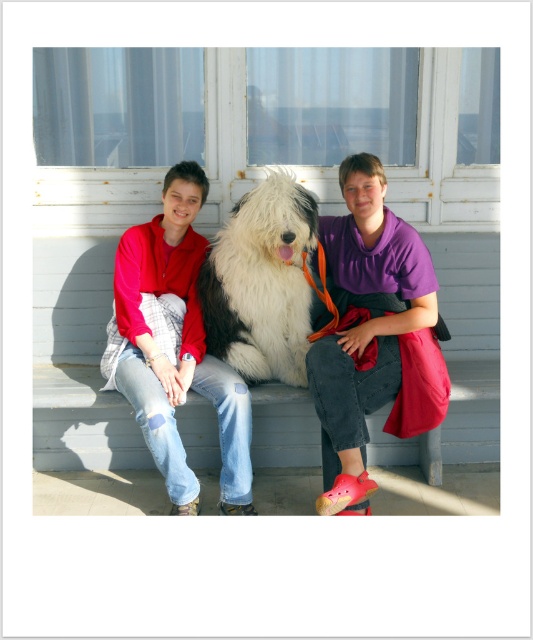
Question: Is fluffy fur dog at center to the left of fluffy white dog at center from the viewer's perspective?

Choices:
 (A) yes
 (B) no

Answer: (B)

Question: Can you confirm if fluffy fur dog at center is positioned above matte red jacket at left?

Choices:
 (A) yes
 (B) no

Answer: (A)

Question: Does matte red jacket at left appear on the left side of fluffy white dog at center?

Choices:
 (A) no
 (B) yes

Answer: (B)

Question: Estimate the real-world distances between objects in this image. Which object is closer to the matte red jacket at left?

Choices:
 (A) fluffy white dog at center
 (B) fluffy fur dog at center

Answer: (A)

Question: Among these points, which one is farthest from the camera?

Choices:
 (A) (229, 502)
 (B) (263, 326)
 (C) (427, 372)
 (D) (342, 435)

Answer: (B)

Question: Which object appears farthest from the camera in this image?

Choices:
 (A) fluffy fur dog at center
 (B) matte red jacket at left

Answer: (B)